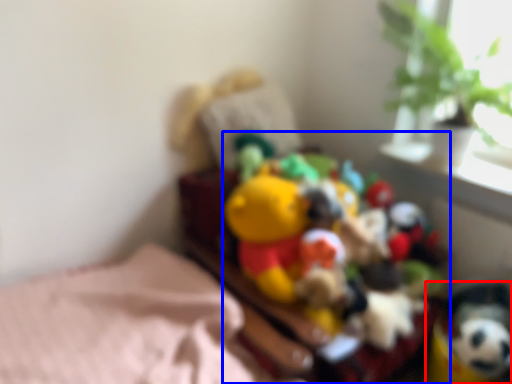
Question: Which point is further to the camera, toy (highlighted by a red box) or toy (highlighted by a blue box)?

Choices:
 (A) toy
 (B) toy

Answer: (A)